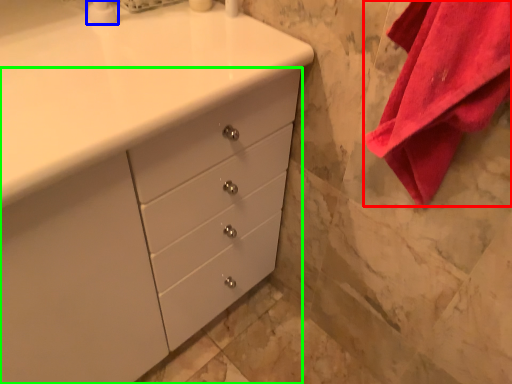
Question: Estimate the real-world distances between objects in this image. Which object is closer to bath towel (highlighted by a red box), soap dispenser (highlighted by a blue box) or chest of drawers (highlighted by a green box)?

Choices:
 (A) soap dispenser
 (B) chest of drawers

Answer: (B)